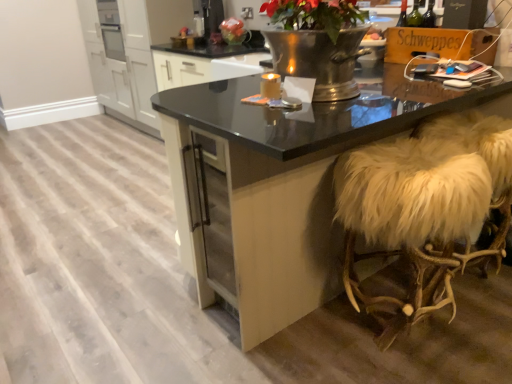
Describe the element at coordinates (129, 52) in the screenshot. I see `white matte cabinet at left` at that location.

Locate an element on the screen. The width and height of the screenshot is (512, 384). matte gold candle at center is located at coordinates (270, 86).

Find the location of a particular element. black glossy table at center is located at coordinates (280, 186).

Identify the location of white matte cabinet at left. This screenshot has width=512, height=384. (129, 52).

Is matte plastic bag at upper center next to white matte cabinet at left?

No.

Is matte plastic bag at upper center wider than white matte cabinet at left?

No, matte plastic bag at upper center is not wider than white matte cabinet at left.

This screenshot has width=512, height=384. I want to click on table below the white matte cabinet at left (from the image's perspective), so click(280, 186).

Which is behind, black glossy table at center or white matte cabinet at left?

white matte cabinet at left is further away from the camera.

Which of these two, black glossy table at center or white matte cabinet at left, stands shorter?

With less height is black glossy table at center.

Which object is positioned more to the right, black glossy table at center or white matte cabinet at left?

From the viewer's perspective, black glossy table at center appears more on the right side.

Is black glossy table at center not close to matte plastic bag at upper center?

Yes, black glossy table at center and matte plastic bag at upper center are located far from each other.

From a real-world perspective, is black glossy table at center under matte plastic bag at upper center?

Yes, from a real-world perspective, black glossy table at center is beneath matte plastic bag at upper center.

In the image, is black glossy table at center positioned in front of or behind matte plastic bag at upper center?

black glossy table at center is in front of matte plastic bag at upper center.

Is point (374, 232) behind point (233, 17)?

No, (374, 232) is closer to viewer.

Are white fur-covered stool at right and matte plastic bag at upper center far apart?

white fur-covered stool at right is positioned a significant distance from matte plastic bag at upper center.

Can you confirm if white fur-covered stool at right is positioned to the right of matte plastic bag at upper center?

Correct, you'll find white fur-covered stool at right to the right of matte plastic bag at upper center.

Is white fur-covered stool at right inside the boundaries of matte plastic bag at upper center, or outside?

white fur-covered stool at right exists outside the volume of matte plastic bag at upper center.

Is matte plastic bag at upper center placed right next to matte gold candle at center?

No, matte plastic bag at upper center is not making contact with matte gold candle at center.

Consider the image. Is matte gold candle at center a part of matte plastic bag at upper center?

No, matte gold candle at center is not surrounded by matte plastic bag at upper center.

Is matte plastic bag at upper center looking in the opposite direction of matte gold candle at center?

matte plastic bag at upper center is not turned away from matte gold candle at center.

Identify the location of candle in front of the matte plastic bag at upper center. This screenshot has height=384, width=512. (270, 86).

From the image's perspective, is matte gold candle at center below white matte cabinet at left?

Correct, matte gold candle at center appears lower than white matte cabinet at left in the image.

Looking at the image, does matte gold candle at center seem bigger or smaller compared to white matte cabinet at left?

Considering their sizes, matte gold candle at center takes up less space than white matte cabinet at left.

Is matte gold candle at center thinner than white matte cabinet at left?

Correct, the width of matte gold candle at center is less than that of white matte cabinet at left.

Is matte gold candle at center facing away from white matte cabinet at left?

No, matte gold candle at center is not facing the opposite direction of white matte cabinet at left.

In terms of width, does white matte cabinet at left look wider or thinner when compared to matte plastic bag at upper center?

Clearly, white matte cabinet at left has more width compared to matte plastic bag at upper center.

Considering the relative positions of white matte cabinet at left and matte plastic bag at upper center in the image provided, is white matte cabinet at left to the right of matte plastic bag at upper center from the viewer's perspective?

No, white matte cabinet at left is not to the right of matte plastic bag at upper center.

Is white matte cabinet at left beside matte plastic bag at upper center?

No, white matte cabinet at left is not with matte plastic bag at upper center.

Is the depth of white matte cabinet at left less than that of matte plastic bag at upper center?

That is False.

The width and height of the screenshot is (512, 384). Identify the location of cabinetry that appears behind the matte plastic bag at upper center. (129, 52).

You are a GUI agent. You are given a task and a screenshot of the screen. Output one action in this format:
    pyautogui.click(x=<x>, y=<y>)
    Task: Click on the cabinetry positioned vertically above the black glossy table at center (from a real-world perspective)
    
    Given the screenshot: What is the action you would take?
    click(129, 52)

When comparing their distances from white matte cabinet at left, does matte gold candle at center or black glossy table at center seem closer?

black glossy table at center is closer to white matte cabinet at left.

Estimate the real-world distances between objects in this image. Which object is closer to matte gold candle at center, white fur-covered stool at right or matte plastic bag at upper center?

white fur-covered stool at right is positioned closer to the anchor matte gold candle at center.

Estimate the real-world distances between objects in this image. Which object is closer to white matte cabinet at left, white fur-covered stool at right or matte gold candle at center?

Among the two, white fur-covered stool at right is located nearer to white matte cabinet at left.

Considering their positions, is white matte cabinet at left positioned further to matte gold candle at center than white fur-covered stool at right?

The object further to matte gold candle at center is white matte cabinet at left.

Consider the image. Looking at the image, which one is located further to black glossy table at center, matte gold candle at center or matte plastic bag at upper center?

matte plastic bag at upper center is positioned further to the anchor black glossy table at center.

Estimate the real-world distances between objects in this image. Which object is further from white matte cabinet at left, matte plastic bag at upper center or white fur-covered stool at right?

The object further to white matte cabinet at left is white fur-covered stool at right.

Which object lies further to the anchor point matte plastic bag at upper center, black glossy table at center or white fur-covered stool at right?

white fur-covered stool at right is positioned further to the anchor matte plastic bag at upper center.

Based on their spatial positions, is white matte cabinet at left or white fur-covered stool at right further from matte plastic bag at upper center?

Among the two, white fur-covered stool at right is located further to matte plastic bag at upper center.

You are a GUI agent. You are given a task and a screenshot of the screen. Output one action in this format:
    pyautogui.click(x=<x>, y=<y>)
    Task: Click on the candle between black glossy table at center and white matte cabinet at left from front to back
    
    Given the screenshot: What is the action you would take?
    pyautogui.click(x=270, y=86)

This screenshot has width=512, height=384. Identify the location of swivel chair between black glossy table at center and matte plastic bag at upper center from front to back. (425, 208).

Find the location of a particular element. swivel chair between black glossy table at center and white matte cabinet at left from front to back is located at coordinates (425, 208).

The image size is (512, 384). Identify the location of flower positioned between matte gold candle at center and white matte cabinet at left from near to far. (233, 26).